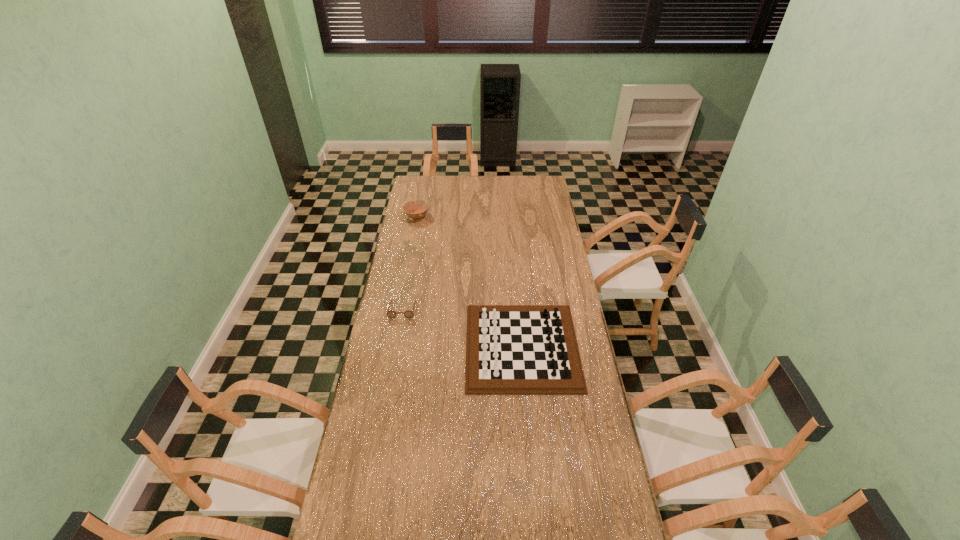
At what (x,y) coordinates should I click in order to perform the action: click on vacant area in the image that satisfies the following two spatial constraints: 1. on the front-facing side of the rightmost object; 2. on the right side of the shortest object. Please return your answer as a coordinate pair (x, y). The image size is (960, 540). Looking at the image, I should click on (396, 346).

This screenshot has width=960, height=540. What are the coordinates of `vacant area in the image that satisfies the following two spatial constraints: 1. on the front-facing side of the spectacles; 2. on the left side of the tallest object` in the screenshot? It's located at (396, 346).

Where is `blank area in the image that satisfies the following two spatial constraints: 1. on the front side of the farthest object; 2. on the left side of the tallest object`? blank area in the image that satisfies the following two spatial constraints: 1. on the front side of the farthest object; 2. on the left side of the tallest object is located at coordinates (393, 346).